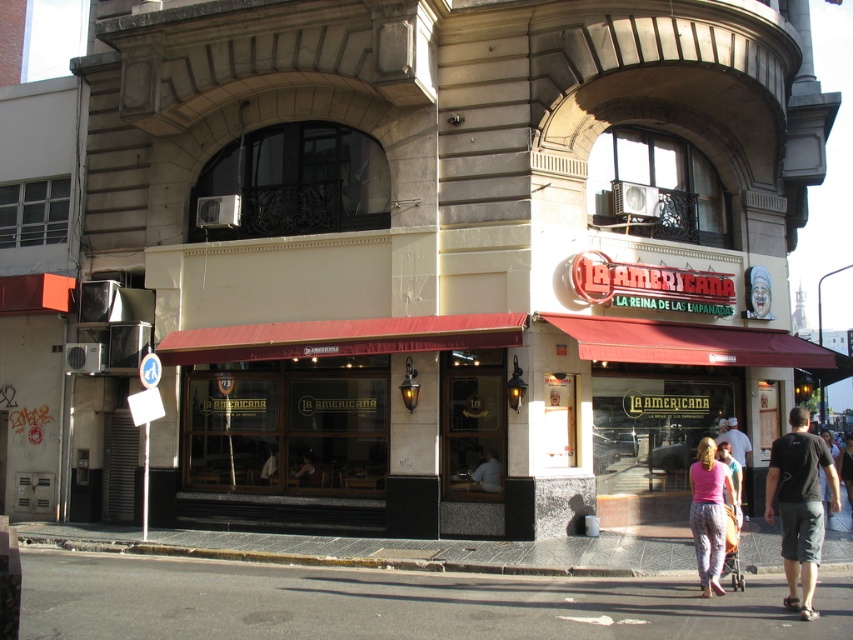
You are a customer entering the restaurant and see the pink fabric pants at lower right and the smooth wooden chair at center. Which item takes up more space in the entrance area?

The pink fabric pants at lower right takes up more space in the entrance area than the smooth wooden chair at center because it is larger in size.

Based on the photo, you are standing in front of the restaurant and want to walk from the black asphalt at lower center to the black cotton shirt at lower right. Which object is closer to you as you start your walk?

The black asphalt at lower center is closer to the viewer than the black cotton shirt at lower right, so you are already closer to the black asphalt at lower center when starting your walk.

You are standing at the entrance of the restaurant and looking down. You see the black asphalt at lower center and the black cotton shirt at lower right. Which object is closer to your feet?

The black asphalt at lower center is closer to your feet since it is positioned below the black cotton shirt at lower right.